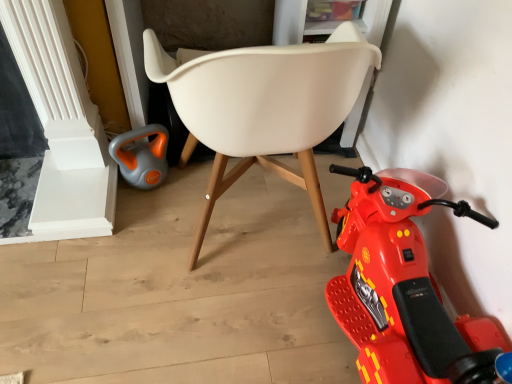
In order to click on free region on the left part of white plastic chair at center in this screenshot , I will do `click(102, 266)`.